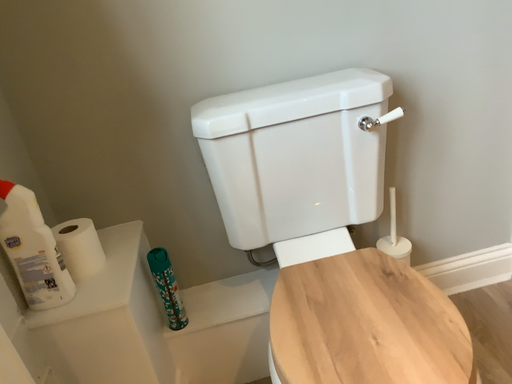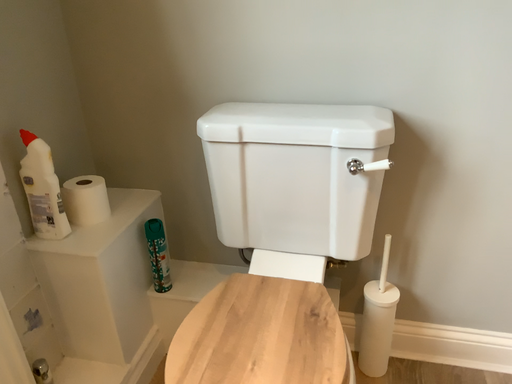
Question: How did the camera likely rotate when shooting the video?

Choices:
 (A) rotated left
 (B) rotated right

Answer: (A)